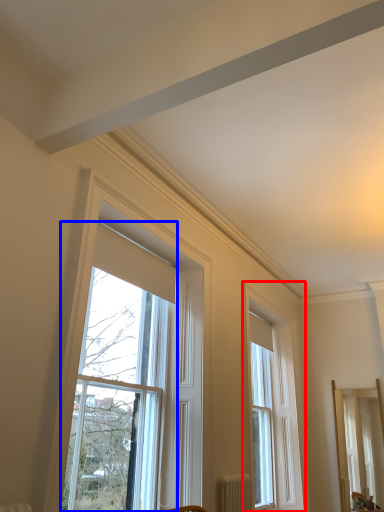
Question: Which object appears closest to the camera in this image, window (highlighted by a red box) or window (highlighted by a blue box)?

Choices:
 (A) window
 (B) window

Answer: (B)